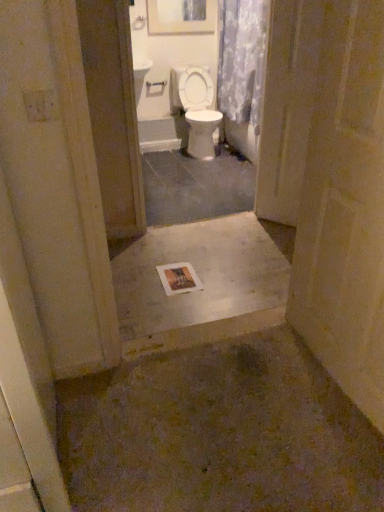
The width and height of the screenshot is (384, 512). What are the coordinates of `free space in front of clear plastic screen door at center` in the screenshot? It's located at (272, 231).